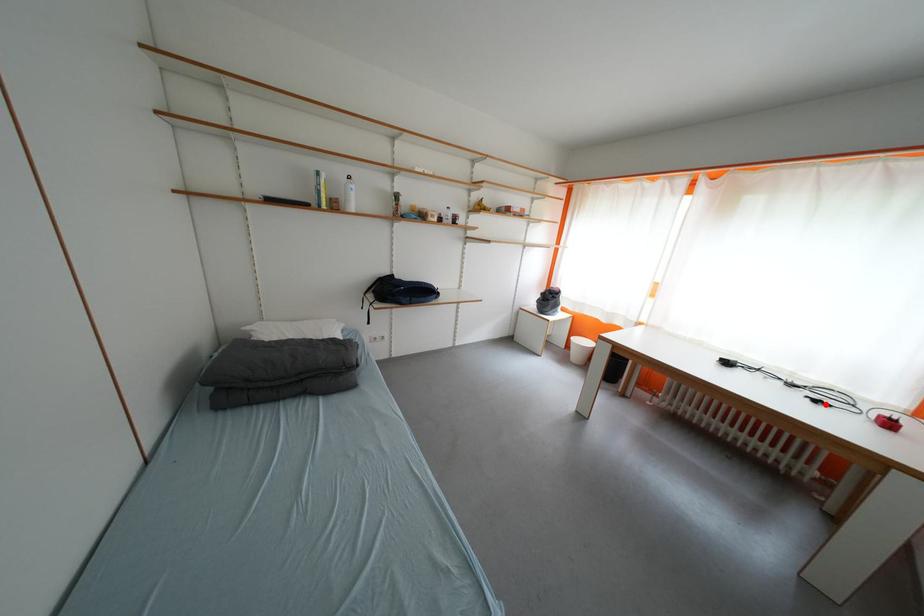
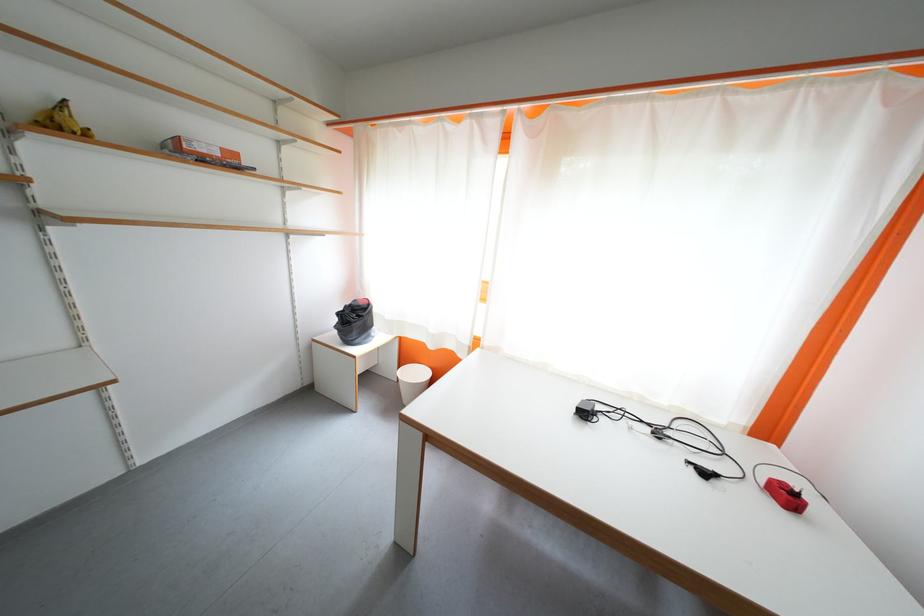
Find the pixel in the second image that matches the highlighted location in the first image.

(713, 477)